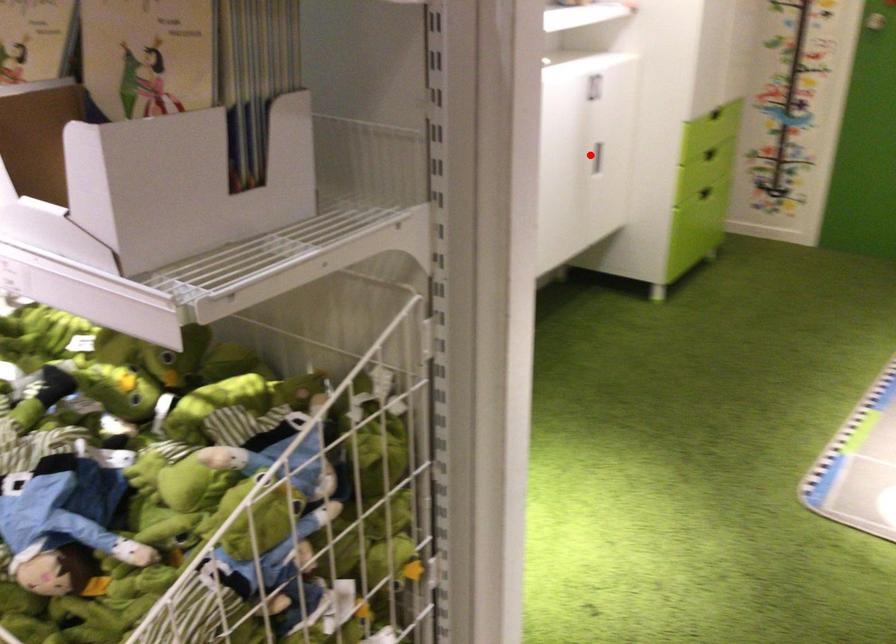
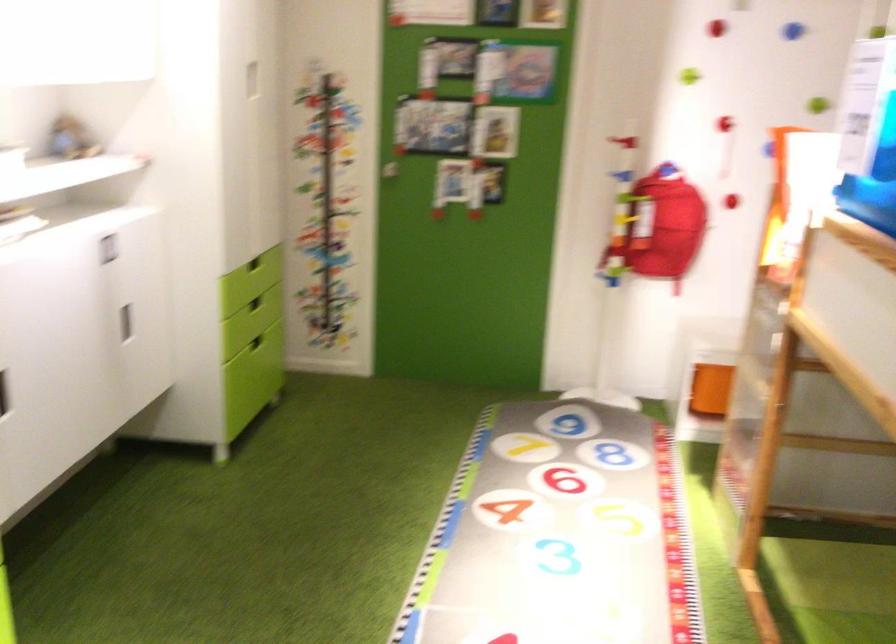
Question: I am providing you with two images of the same scene from different viewpoints. Image1 has a red point marked. In image2, the corresponding 3D location appears at what relative position? Reply with the corresponding letter.

Choices:
 (A) Closer
 (B) Farther

Answer: (A)